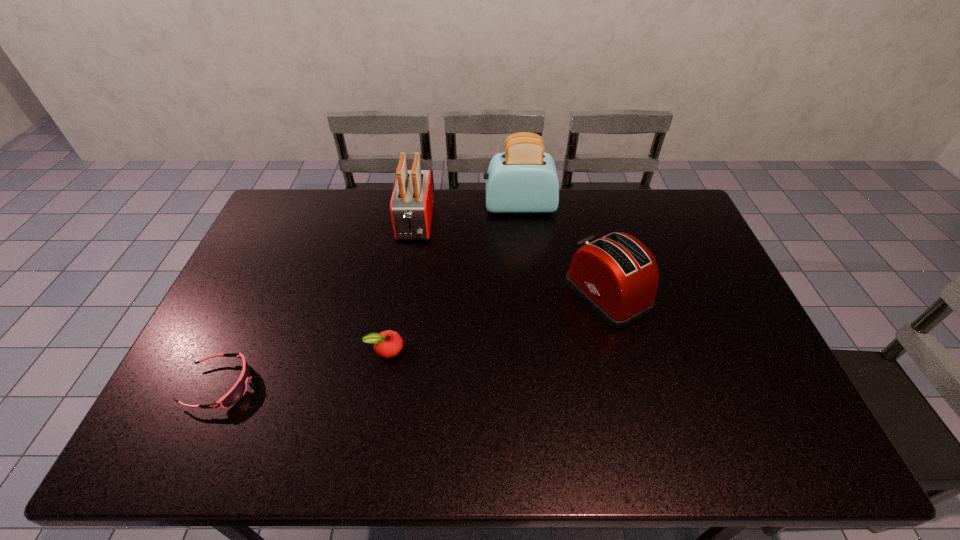
This screenshot has width=960, height=540. I want to click on the leftmost toaster, so pos(411,206).

The image size is (960, 540). Find the location of `the third shortest object`. the third shortest object is located at coordinates (616, 275).

Identify the location of the nearest toaster. Image resolution: width=960 pixels, height=540 pixels. (616, 275).

You are a GUI agent. You are given a task and a screenshot of the screen. Output one action in this format:
    pyautogui.click(x=<x>, y=<y>)
    Task: Click on the apple
    The width and height of the screenshot is (960, 540).
    Given the screenshot: What is the action you would take?
    pyautogui.click(x=388, y=344)

Identify the location of goggles. (238, 390).

I want to click on the shortest object, so click(x=238, y=390).

Find the location of a particular element. The height and width of the screenshot is (540, 960). vacant space located 0.370m on the front-facing side of the leftmost toaster is located at coordinates (397, 334).

At what (x,y) coordinates should I click in order to perform the action: click on vacant space located on the back of the third shortest object. Please return your answer as a coordinate pair (x, y). Image resolution: width=960 pixels, height=540 pixels. Looking at the image, I should click on (595, 249).

Locate an element on the screen. The width and height of the screenshot is (960, 540). blank area located 0.260m on the left of the fourth tallest object is located at coordinates (272, 349).

I want to click on free space located 0.110m on the front-facing side of the shortest object, so click(295, 386).